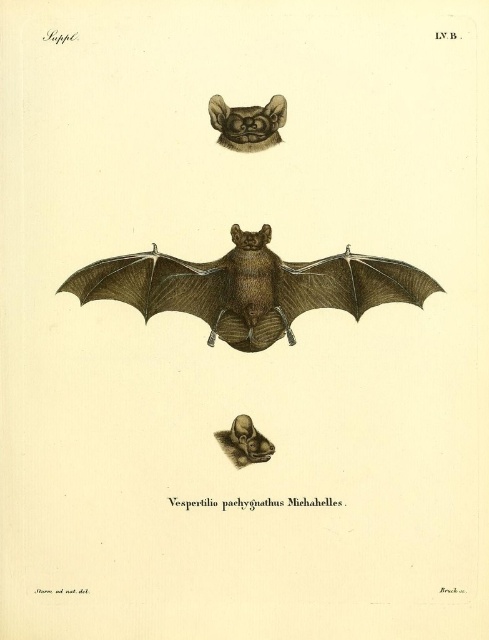
You are examining a scientific illustration of a bat species. You notice two bats in the image. One is labeled as the brown textured bat at center and the other as the brown fur bat at upper center. Which bat appears closer to you?

The brown textured bat at center appears closer to you than the brown fur bat at upper center.

You are examining the scientific illustration of the bat species Vespertilio paelygnathus Michahelles. You notice two points labeled as point 1 at coordinates point 1 at coordinates point (390, 294) and point 2 at coordinates point (272, 138). From your perspective as an observer, which point is positioned closer to you?

Point (390, 294) is closer to the viewer than point (272, 138).